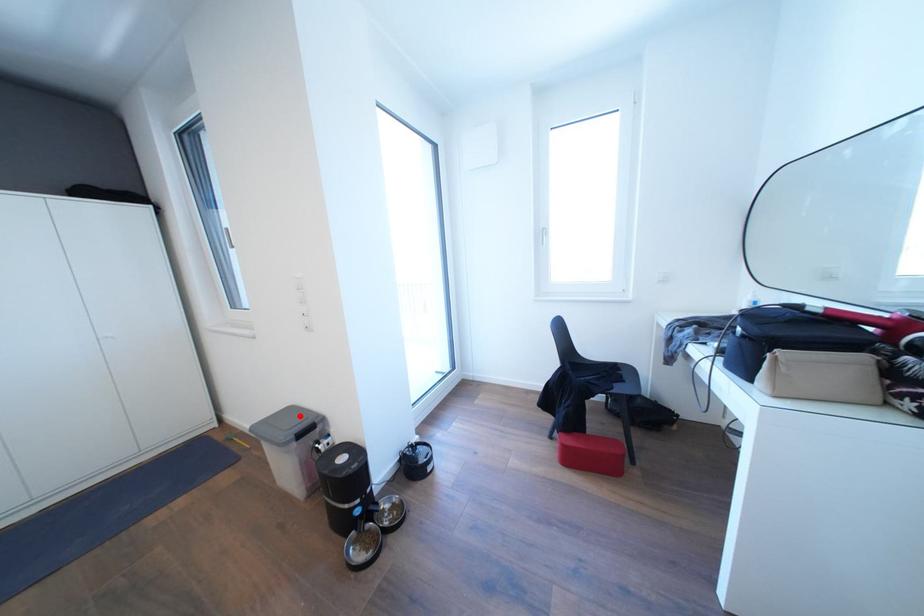
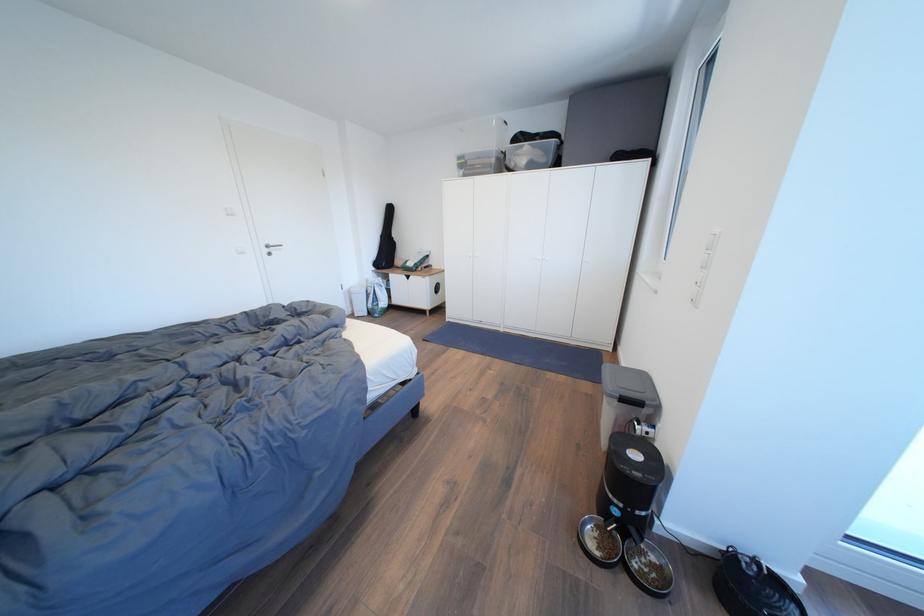
Question: I am providing you with two images of the same scene from different viewpoints. A red point is shown in image1. For the corresponding object point in image2, is it positioned nearer or farther from the camera?

Choices:
 (A) Nearer
 (B) Farther

Answer: (A)